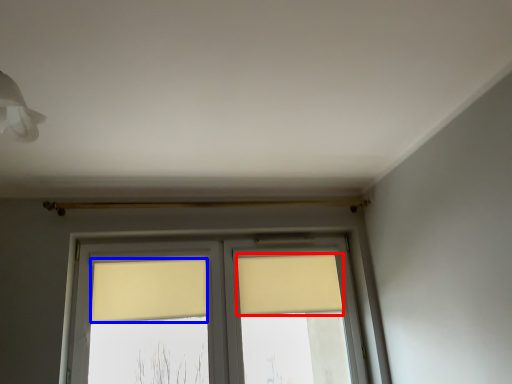
Question: Which of the following is the closest to the observer, curtain (highlighted by a red box) or curtain (highlighted by a blue box)?

Choices:
 (A) curtain
 (B) curtain

Answer: (B)